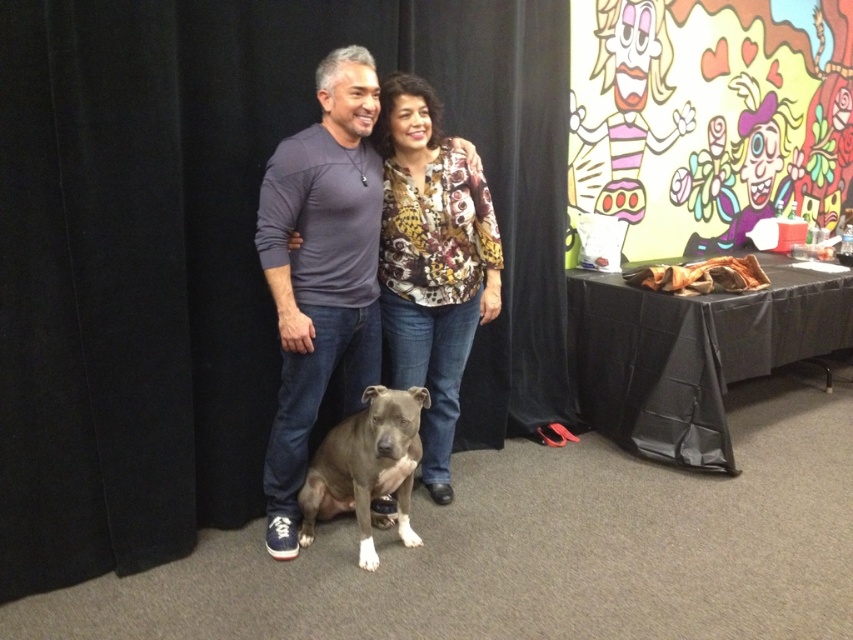
Question: From the image, what is the correct spatial relationship of matte gray dog at center in relation to gray matte dog at lower center?

Choices:
 (A) left
 (B) right

Answer: (A)

Question: Which is farther from the printed fabric blouse at center?

Choices:
 (A) gray matte dog at lower center
 (B) matte gray dog at center

Answer: (A)

Question: Can you confirm if printed fabric blouse at center is positioned above gray matte dog at lower center?

Choices:
 (A) no
 (B) yes

Answer: (B)

Question: Which is nearer to the printed fabric blouse at center?

Choices:
 (A) gray matte dog at lower center
 (B) matte gray dog at center

Answer: (B)

Question: Considering the real-world distances, which object is closest to the gray matte dog at lower center?

Choices:
 (A) printed fabric blouse at center
 (B) matte gray dog at center

Answer: (B)

Question: Is printed fabric blouse at center behind gray matte dog at lower center?

Choices:
 (A) yes
 (B) no

Answer: (A)